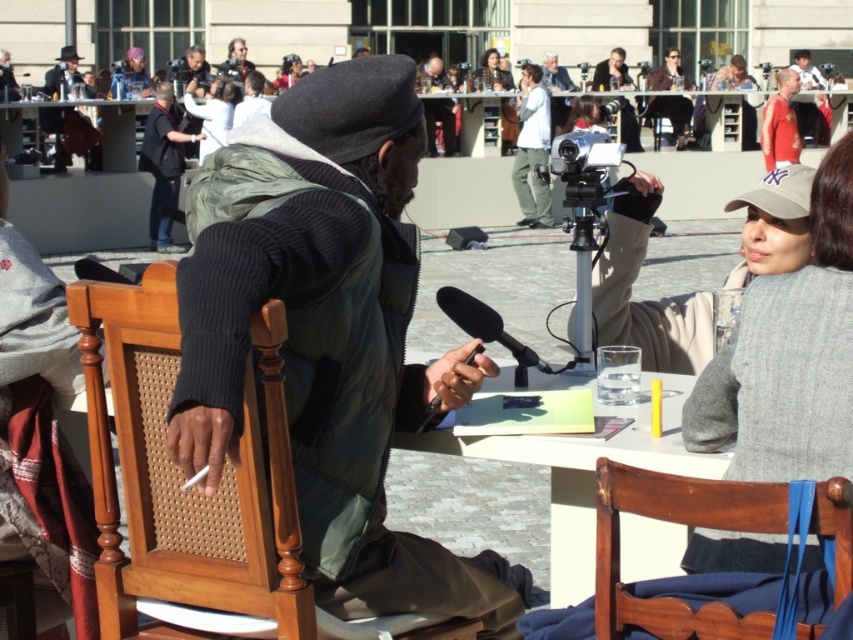
Consider the image. You are a photographer at the event and want to position yourself so that both the white glossy table at center and the matte gray jacket at upper center are visible in your frame. Based on their positions, which side of the scene should you stand to capture both objects in your shot?

The white glossy table at center is to the left of the matte gray jacket at upper center, so you should position yourself on the right side of the scene to ensure both objects are visible in your frame.